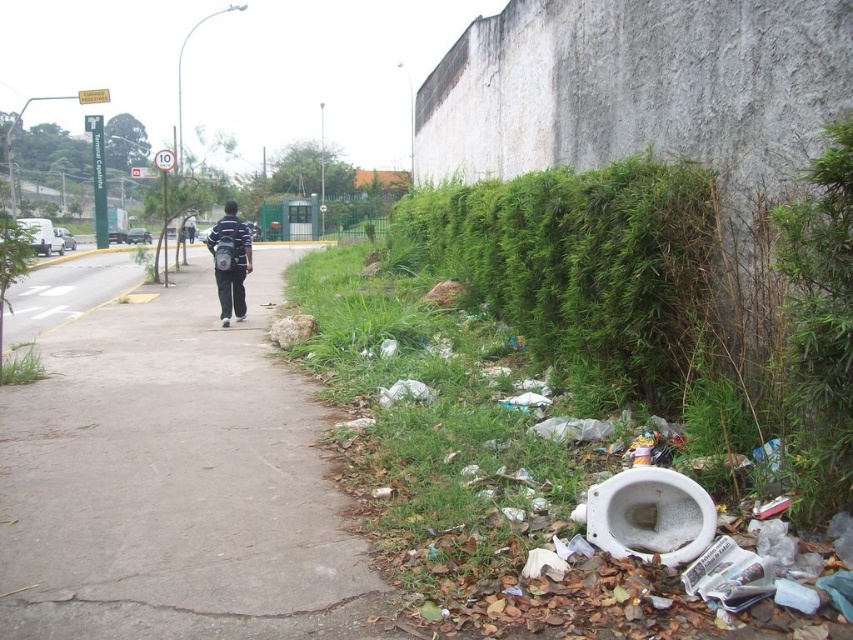
Based on the photo, is green leafy hedge at right to the left of white ceramic toilet at lower right from the viewer's perspective?

Indeed, green leafy hedge at right is positioned on the left side of white ceramic toilet at lower right.

In the scene shown: Can you confirm if green leafy hedge at right is positioned below white ceramic toilet at lower right?

No.

Which is behind, point (457, 230) or point (670, 513)?

The point (457, 230) is behind.

Identify the location of green leafy hedge at right. The image size is (853, 640). (583, 268).

Between point (224, 440) and point (532, 308), which one is positioned behind?

Positioned behind is point (532, 308).

Is gray concrete sidewalk at center smaller than green leafy hedge at right?

Correct, gray concrete sidewalk at center occupies less space than green leafy hedge at right.

The width and height of the screenshot is (853, 640). Describe the element at coordinates (175, 483) in the screenshot. I see `gray concrete sidewalk at center` at that location.

Find the location of a particular element. The height and width of the screenshot is (640, 853). gray concrete sidewalk at center is located at coordinates (175, 483).

Does point (212, 582) come closer to viewer compared to point (705, 499)?

That is False.

Which is more to the left, gray concrete sidewalk at center or white ceramic toilet at lower right?

Positioned to the left is gray concrete sidewalk at center.

Does point (219, 586) lie in front of point (706, 506)?

No, it is behind (706, 506).

I want to click on gray concrete sidewalk at center, so click(x=175, y=483).